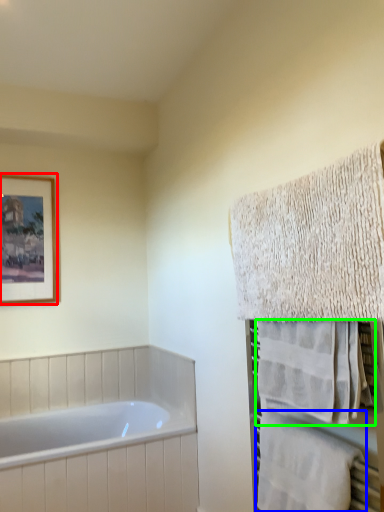
Question: Which object is the closest to the picture frame (highlighted by a red box)? Choose among these: towel (highlighted by a blue box) or towel (highlighted by a green box).

Choices:
 (A) towel
 (B) towel

Answer: (B)